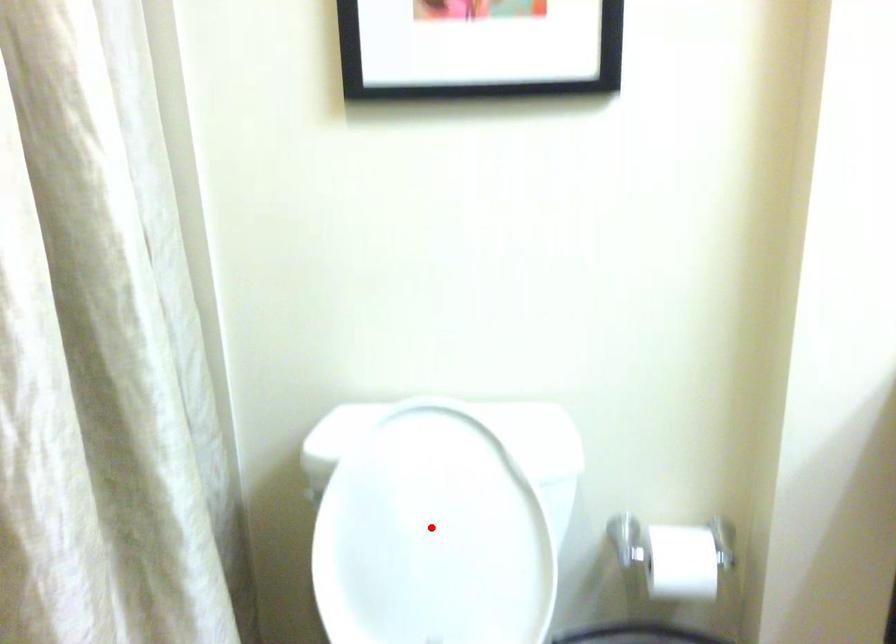
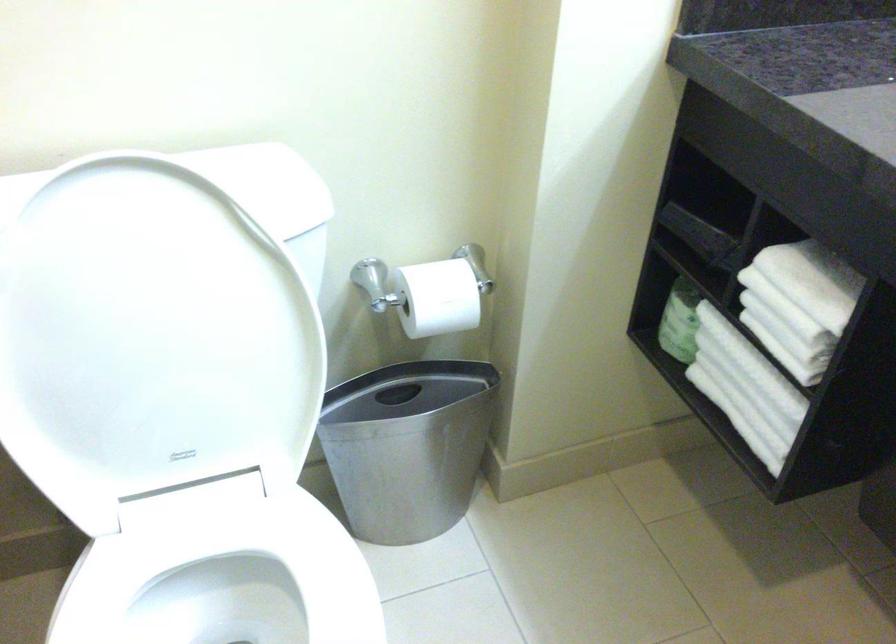
Question: I am providing you with two images of the same scene from different viewpoints. Image1 has a red point marked. In image2, the corresponding 3D location appears at what relative position? Reply with the corresponding letter.

Choices:
 (A) Closer
 (B) Farther

Answer: (A)